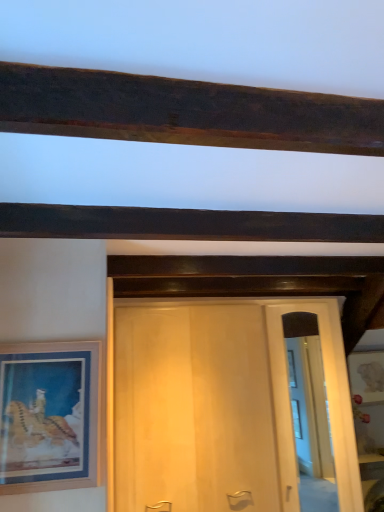
Question: Would you consider clear glass door at center to be distant from dark wood beam at upper center?

Choices:
 (A) yes
 (B) no

Answer: (A)

Question: Considering the relative sizes of clear glass door at center and dark wood beam at upper center in the image provided, is clear glass door at center bigger than dark wood beam at upper center?

Choices:
 (A) no
 (B) yes

Answer: (A)

Question: Is clear glass door at center beside dark wood beam at upper center?

Choices:
 (A) yes
 (B) no

Answer: (B)

Question: From the image's perspective, is clear glass door at center below dark wood beam at upper center?

Choices:
 (A) no
 (B) yes

Answer: (B)

Question: Is clear glass door at center completely or partially outside of dark wood beam at upper center?

Choices:
 (A) no
 (B) yes

Answer: (B)

Question: From the image's perspective, is wooden picture frame at left above or below dark wood beam at upper center?

Choices:
 (A) above
 (B) below

Answer: (B)

Question: In terms of width, does wooden picture frame at left look wider or thinner when compared to dark wood beam at upper center?

Choices:
 (A) thin
 (B) wide

Answer: (A)

Question: From a real-world perspective, is wooden picture frame at left positioned above or below dark wood beam at upper center?

Choices:
 (A) below
 (B) above

Answer: (A)

Question: Relative to dark wood beam at upper center, is wooden picture frame at left in front or behind?

Choices:
 (A) behind
 (B) front

Answer: (A)

Question: Is clear glass door at center wider or thinner than dark wood beam at upper center?

Choices:
 (A) thin
 (B) wide

Answer: (A)

Question: Considering their positions, is clear glass door at center located in front of or behind dark wood beam at upper center?

Choices:
 (A) behind
 (B) front

Answer: (A)

Question: From a real-world perspective, is clear glass door at center physically located above or below dark wood beam at upper center?

Choices:
 (A) above
 (B) below

Answer: (B)

Question: From the image's perspective, relative to dark wood beam at upper center, is clear glass door at center above or below?

Choices:
 (A) above
 (B) below

Answer: (B)

Question: Does point (340, 410) appear closer or farther from the camera than point (64, 410)?

Choices:
 (A) farther
 (B) closer

Answer: (A)

Question: From the image's perspective, is clear glass door at center positioned above or below wooden picture frame at left?

Choices:
 (A) below
 (B) above

Answer: (A)